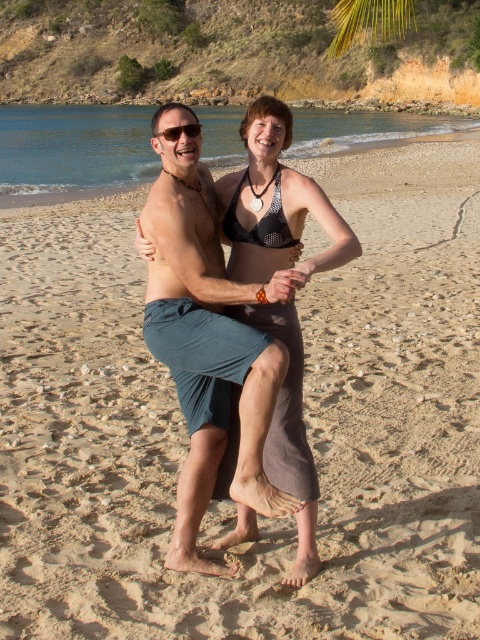
Question: Is matte gray sarong at center to the right of green leafy palm tree at upper right from the viewer's perspective?

Choices:
 (A) no
 (B) yes

Answer: (A)

Question: Is matte gray sarong at center closer to camera compared to matte black sunglasses at upper center?

Choices:
 (A) yes
 (B) no

Answer: (A)

Question: Which of the following is the farthest from the observer?

Choices:
 (A) matte black sunglasses at upper center
 (B) matte gray sarong at center

Answer: (A)

Question: Is matte gray sarong at center bigger than matte black sunglasses at upper center?

Choices:
 (A) yes
 (B) no

Answer: (B)

Question: Among these points, which one is nearest to the camera?

Choices:
 (A) (381, 38)
 (B) (320, 195)

Answer: (B)

Question: Among these objects, which one is farthest from the camera?

Choices:
 (A) green leafy palm tree at upper right
 (B) matte black sunglasses at upper center
 (C) matte gray sarong at center

Answer: (A)